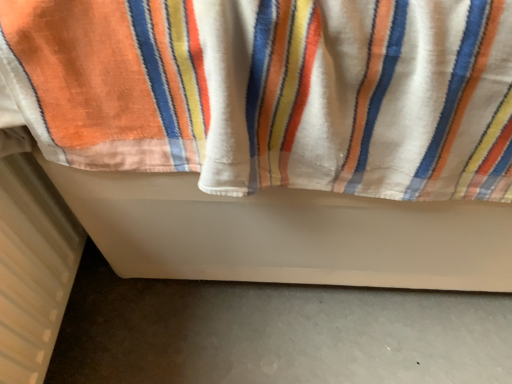
Question: From the image's perspective, does white textured radiator at lower left appear lower than white soft towel at center?

Choices:
 (A) no
 (B) yes

Answer: (B)

Question: Is white textured radiator at lower left facing away from white soft towel at center?

Choices:
 (A) no
 (B) yes

Answer: (B)

Question: From the image's perspective, is white textured radiator at lower left located above white soft towel at center?

Choices:
 (A) yes
 (B) no

Answer: (B)

Question: Is white textured radiator at lower left taller than white soft towel at center?

Choices:
 (A) no
 (B) yes

Answer: (A)

Question: Is white textured radiator at lower left closer to the viewer compared to white soft towel at center?

Choices:
 (A) yes
 (B) no

Answer: (B)

Question: Is white textured radiator at lower left not within white soft towel at center?

Choices:
 (A) no
 (B) yes

Answer: (A)

Question: Is white soft towel at center oriented towards white textured radiator at lower left?

Choices:
 (A) yes
 (B) no

Answer: (A)

Question: Is white textured radiator at lower left at the back of white soft towel at center?

Choices:
 (A) no
 (B) yes

Answer: (A)

Question: Is white soft towel at center smaller than white textured radiator at lower left?

Choices:
 (A) yes
 (B) no

Answer: (B)

Question: Considering the relative positions of white soft towel at center and white textured radiator at lower left in the image provided, is white soft towel at center to the left of white textured radiator at lower left from the viewer's perspective?

Choices:
 (A) yes
 (B) no

Answer: (B)

Question: Can you confirm if white soft towel at center is shorter than white textured radiator at lower left?

Choices:
 (A) yes
 (B) no

Answer: (B)

Question: Considering the relative positions of white soft towel at center and white textured radiator at lower left in the image provided, is white soft towel at center to the right of white textured radiator at lower left from the viewer's perspective?

Choices:
 (A) yes
 (B) no

Answer: (A)

Question: Which is correct: white soft towel at center is inside white textured radiator at lower left, or outside of it?

Choices:
 (A) outside
 (B) inside

Answer: (A)